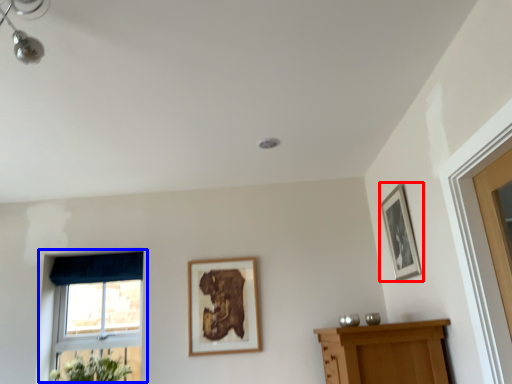
Question: Among these objects, which one is farthest to the camera, picture frame (highlighted by a red box) or window (highlighted by a blue box)?

Choices:
 (A) picture frame
 (B) window

Answer: (B)